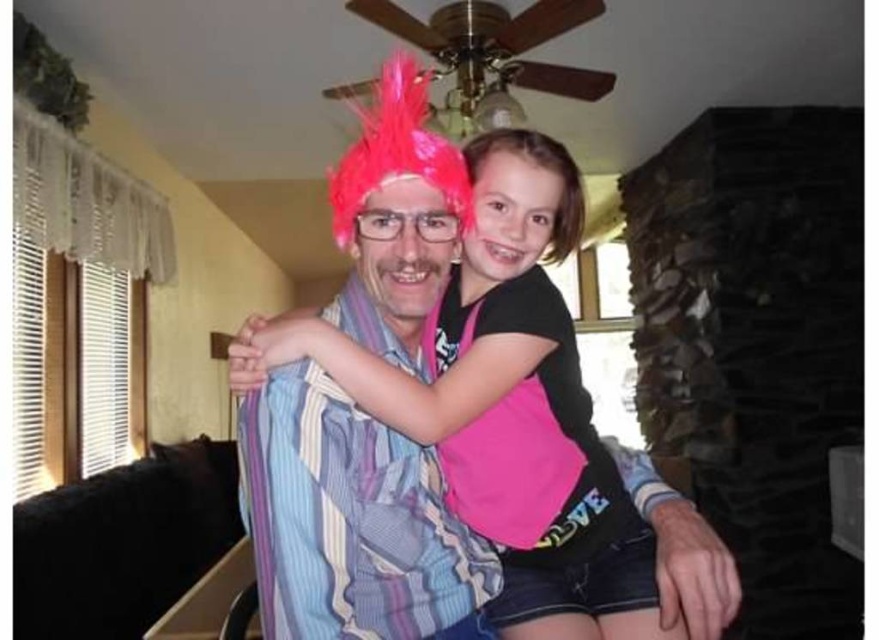
Does pink fabric at center have a smaller size compared to pink feathered wig at upper center?

Incorrect, pink fabric at center is not smaller in size than pink feathered wig at upper center.

Does point (571, 458) come in front of point (509, 145)?

No, (571, 458) is further to viewer.

At what (x,y) coordinates should I click in order to perform the action: click on pink fabric at center. Please return your answer as a coordinate pair (x, y). Looking at the image, I should click on (507, 406).